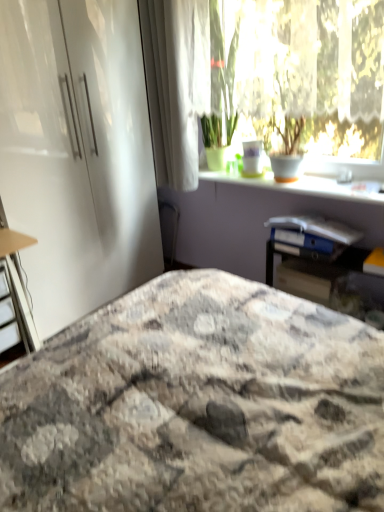
Question: Is matte white desk at left inside or outside of marble-patterned bedspread at center?

Choices:
 (A) outside
 (B) inside

Answer: (A)

Question: In the image, is matte white desk at left positioned in front of or behind marble-patterned bedspread at center?

Choices:
 (A) front
 (B) behind

Answer: (B)

Question: Considering the real-world distances, which object is farthest from the wooden table at right?

Choices:
 (A) transparent glass window at upper center
 (B) marble-patterned bedspread at center
 (C) matte white desk at left
 (D) white glossy window sill at upper center
 (E) white fabric curtain at upper left

Answer: (C)

Question: Estimate the real-world distances between objects in this image. Which object is closer to the white fabric curtain at upper left?

Choices:
 (A) white glossy window sill at upper center
 (B) matte white desk at left
 (C) marble-patterned bedspread at center
 (D) white glossy cabinet at left
 (E) transparent glass window at upper center

Answer: (E)